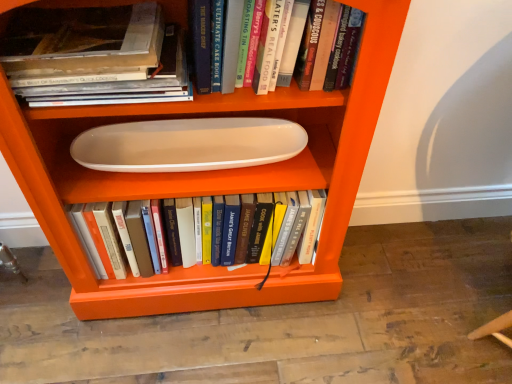
Question: Is white matte oval plate at center, marked as the 3th book in a front-to-back arrangement, further to camera compared to white glossy oval plate at center?

Choices:
 (A) yes
 (B) no

Answer: (A)

Question: From the image's perspective, would you say white matte oval plate at center, the first book when ordered from back to front, is positioned over white glossy oval plate at center?

Choices:
 (A) no
 (B) yes

Answer: (A)

Question: Does white matte oval plate at center, the first book when ordered from back to front, lie in front of white glossy oval plate at center?

Choices:
 (A) no
 (B) yes

Answer: (A)

Question: Are white matte oval plate at center, the first book when ordered from back to front, and white glossy oval plate at center beside each other?

Choices:
 (A) yes
 (B) no

Answer: (B)

Question: Is white matte oval plate at center, marked as the 3th book in a front-to-back arrangement, thinner than white glossy oval plate at center?

Choices:
 (A) no
 (B) yes

Answer: (A)

Question: Does white matte oval plate at center, the first book when ordered from back to front, contain white glossy oval plate at center?

Choices:
 (A) no
 (B) yes

Answer: (A)

Question: From the image's perspective, is hardcover book at upper center, which ranks as the third book in back-to-front order, located beneath matte white book at upper left, arranged as the 2th book when viewed from the back?

Choices:
 (A) no
 (B) yes

Answer: (A)

Question: Considering the relative sizes of hardcover book at upper center, which ranks as the third book in back-to-front order, and matte white book at upper left, which is counted as the 2th book, starting from the front, in the image provided, is hardcover book at upper center, which ranks as the third book in back-to-front order, taller than matte white book at upper left, which is counted as the 2th book, starting from the front,?

Choices:
 (A) no
 (B) yes

Answer: (B)

Question: Is hardcover book at upper center, which ranks as the third book in back-to-front order, in contact with matte white book at upper left, which is counted as the 2th book, starting from the front?

Choices:
 (A) yes
 (B) no

Answer: (B)

Question: Considering the relative sizes of hardcover book at upper center, which ranks as the third book in back-to-front order, and matte white book at upper left, arranged as the 2th book when viewed from the back, in the image provided, is hardcover book at upper center, which ranks as the third book in back-to-front order, bigger than matte white book at upper left, arranged as the 2th book when viewed from the back,?

Choices:
 (A) yes
 (B) no

Answer: (B)

Question: Does hardcover book at upper center, the first book positioned from the front, appear on the right side of matte white book at upper left, arranged as the 2th book when viewed from the back?

Choices:
 (A) yes
 (B) no

Answer: (A)

Question: Is hardcover book at upper center, the first book positioned from the front, oriented away from matte white book at upper left, arranged as the 2th book when viewed from the back?

Choices:
 (A) no
 (B) yes

Answer: (A)

Question: Is matte white book at upper left, arranged as the 2th book when viewed from the back, touching white glossy oval tray at center?

Choices:
 (A) no
 (B) yes

Answer: (A)